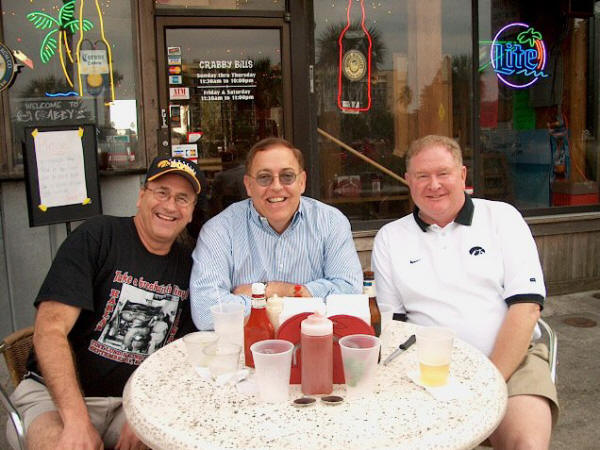
I want to click on chair, so click(553, 344), click(12, 361).